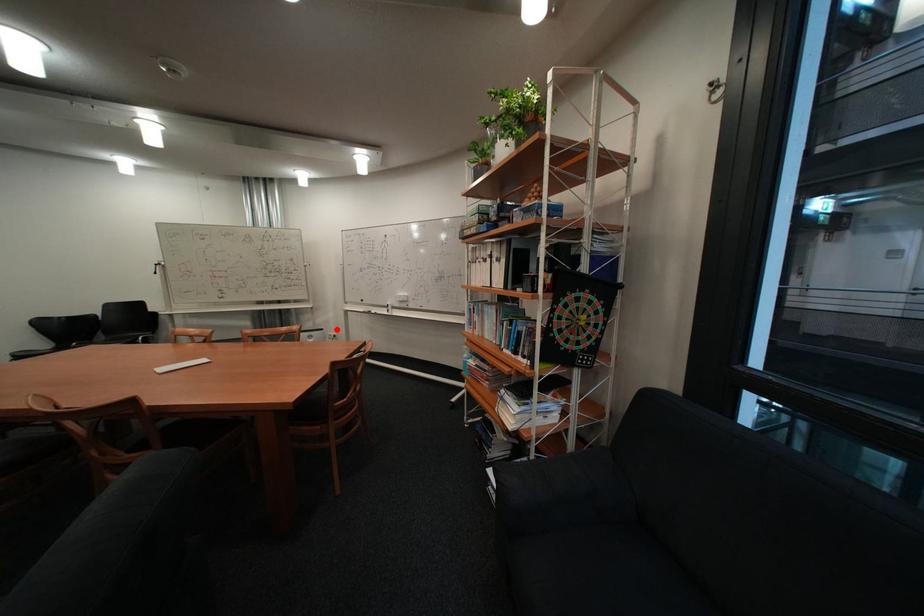
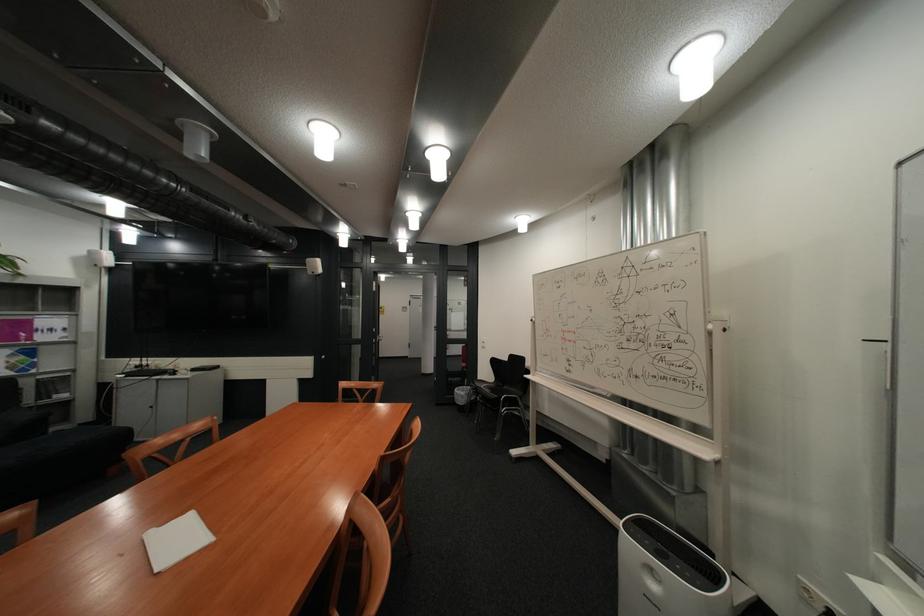
Where in the second image is the point corresponding to the highlighted location from the first image?

(728, 576)